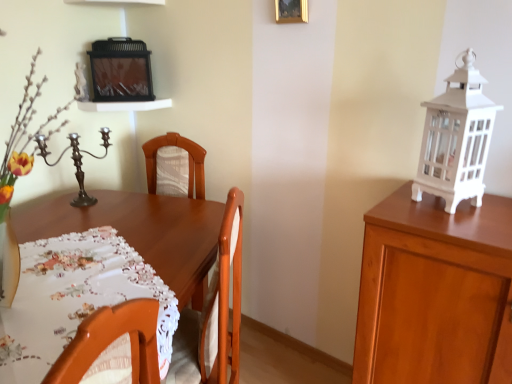
Identify the location of unoccupied region to the right of white painted glass lantern at right. Image resolution: width=512 pixels, height=384 pixels. (497, 203).